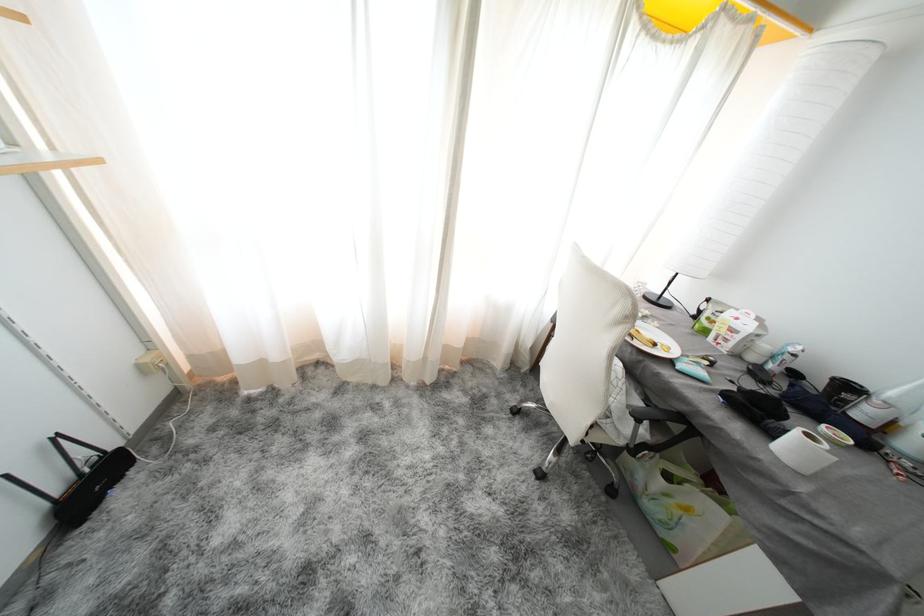
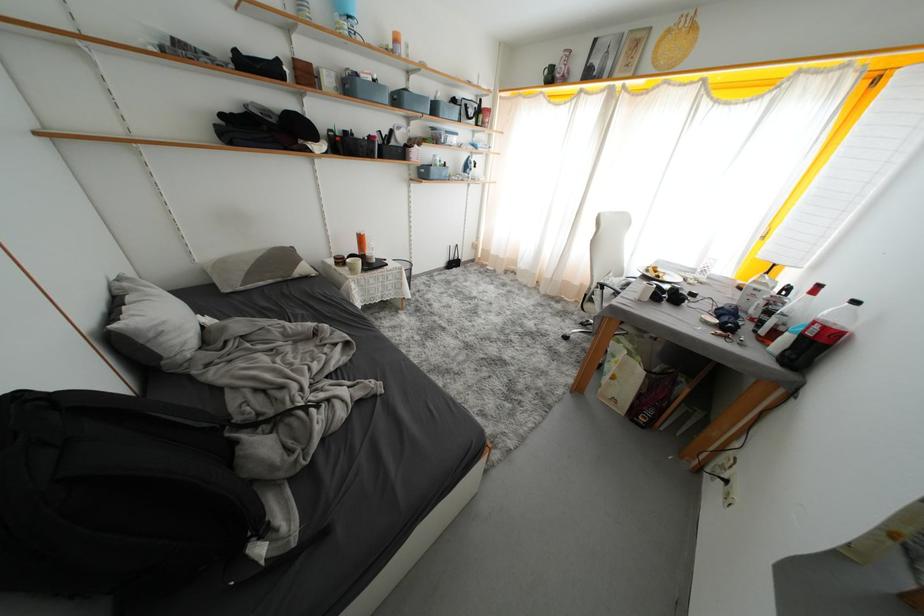
Find the pixel in the second image that matches [763,339] in the first image.

(761, 293)